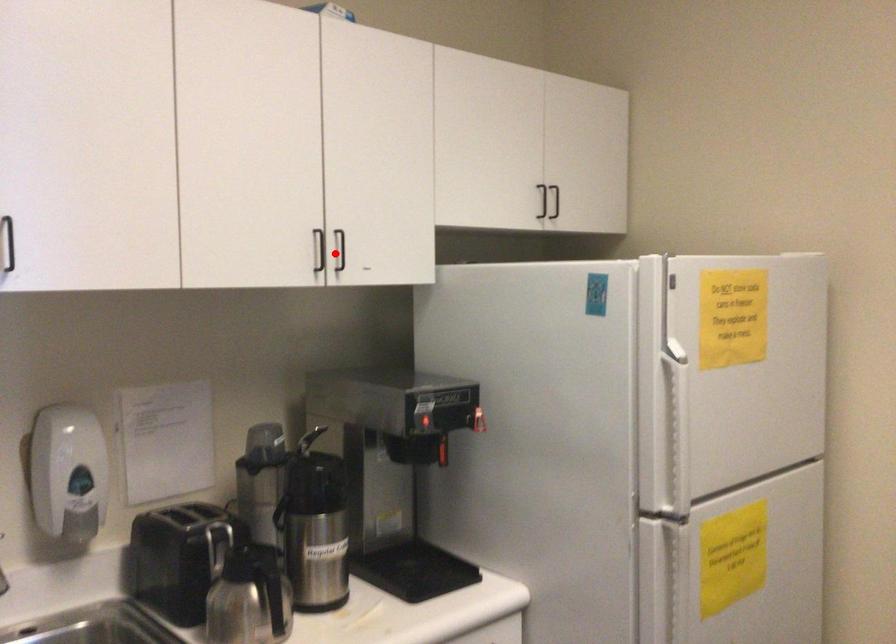
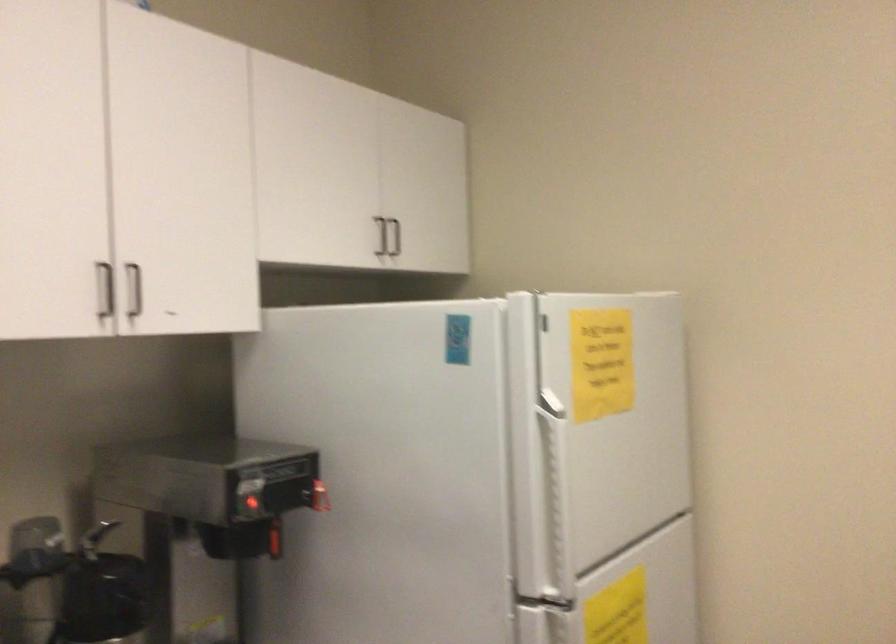
Question: I am providing you with two images of the same scene from different viewpoints. Image1 has a red point marked. In image2, the corresponding 3D location appears at what relative position? Reply with the corresponding letter.

Choices:
 (A) Closer
 (B) Farther

Answer: (A)